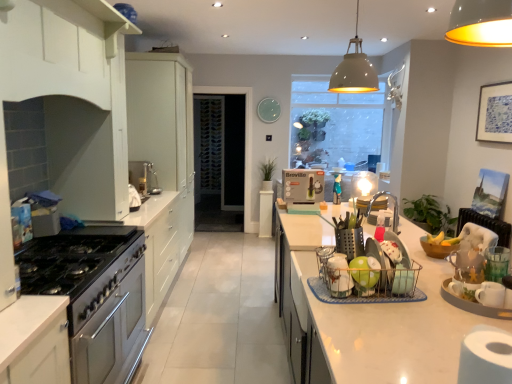
You are a GUI agent. You are given a task and a screenshot of the screen. Output one action in this format:
    pyautogui.click(x=<x>, y=<y>)
    Task: Click on the green matte plant at center, which is the 1th plant from top to bottom
    Image resolution: width=512 pixels, height=384 pixels.
    Given the screenshot: What is the action you would take?
    pyautogui.click(x=267, y=169)

Measure the distance between white wood shelf at upper center, which ranks as the first cabinetry in front-to-back order, and camera.

A distance of 1.42 meters exists between white wood shelf at upper center, which ranks as the first cabinetry in front-to-back order, and camera.

What do you see at coordinates (371, 294) in the screenshot? I see `metallic wire basket at right` at bounding box center [371, 294].

This screenshot has height=384, width=512. Identify the location of metallic wire basket at right. (371, 294).

The image size is (512, 384). What do you see at coordinates (221, 164) in the screenshot?
I see `transparent glass door at center` at bounding box center [221, 164].

The image size is (512, 384). What are the coordinates of `green matte dish rack at center, the fourth appliance when ordered from right to left` in the screenshot? It's located at (339, 276).

I want to click on green matte plant at center, arranged as the 2th plant when ordered from the bottom, so click(267, 169).

Is white matte pendant light at upper center positioned before white matte cabinet at left, arranged as the second cabinetry when viewed from the front?

No.

Which cabinetry is the 3rd one when counting from the left side of the white matte pendant light at upper center? Please provide its 2D coordinates.

[(72, 97)]

Between white matte pendant light at upper center and white matte cabinet at left, arranged as the second cabinetry when viewed from the front, which one has less height?

white matte pendant light at upper center is shorter.

Considering the sizes of objects white matte pendant light at upper center and white matte cabinet at left, which is the 2th cabinetry in back-to-front order, in the image provided, who is thinner, white matte pendant light at upper center or white matte cabinet at left, which is the 2th cabinetry in back-to-front order,?

white matte pendant light at upper center.

Does green leafy plant at right, which appears as the 1th plant when viewed from the right, have a smaller size compared to metallic wire basket at right?

Actually, green leafy plant at right, which appears as the 1th plant when viewed from the right, might be larger than metallic wire basket at right.

From a real-world perspective, is green leafy plant at right, which is counted as the first plant, starting from the front, over metallic wire basket at right?

No, from a real-world perspective, green leafy plant at right, which is counted as the first plant, starting from the front, is not above metallic wire basket at right.

In the image, is green leafy plant at right, which is counted as the first plant, starting from the front, positioned in front of or behind metallic wire basket at right?

green leafy plant at right, which is counted as the first plant, starting from the front, is positioned farther from the viewer than metallic wire basket at right.

Is white wood shelf at upper center, which ranks as the first cabinetry in front-to-back order, touching transparent glass door at center?

white wood shelf at upper center, which ranks as the first cabinetry in front-to-back order, and transparent glass door at center are not in contact.

Is white wood shelf at upper center, which ranks as the first cabinetry in front-to-back order, bigger than transparent glass door at center?

No.

Could you tell me if white wood shelf at upper center, which appears as the 3th cabinetry when viewed from the back, is facing transparent glass door at center?

No, white wood shelf at upper center, which appears as the 3th cabinetry when viewed from the back, is not facing towards transparent glass door at center.

Considering the sizes of white wood shelf at upper center, which ranks as the first cabinetry in front-to-back order, and transparent glass door at center in the image, is white wood shelf at upper center, which ranks as the first cabinetry in front-to-back order, wider or thinner than transparent glass door at center?

In the image, white wood shelf at upper center, which ranks as the first cabinetry in front-to-back order, appears to be more narrow than transparent glass door at center.

Considering the sizes of green leafy plant at right, positioned as the 2th plant in back-to-front order, and stainless steel oven at left in the image, is green leafy plant at right, positioned as the 2th plant in back-to-front order, wider or thinner than stainless steel oven at left?

green leafy plant at right, positioned as the 2th plant in back-to-front order, is thinner than stainless steel oven at left.

Would you say green leafy plant at right, which is the first plant from bottom to top, is outside stainless steel oven at left?

Indeed, green leafy plant at right, which is the first plant from bottom to top, is completely outside stainless steel oven at left.

From a real-world perspective, does green leafy plant at right, positioned as the 2th plant in back-to-front order, stand above stainless steel oven at left?

Yes, from a real-world perspective, green leafy plant at right, positioned as the 2th plant in back-to-front order, is over stainless steel oven at left

Which is in front, metallic silver utensil holder at right, the 3th appliance positioned from the left, or metallic wire basket at right?

metallic wire basket at right is closer to the camera.

Can we say metallic silver utensil holder at right, the third appliance viewed from the back, lies outside metallic wire basket at right?

Yes.

From the image's perspective, between metallic silver utensil holder at right, which appears as the second appliance when viewed from the right, and metallic wire basket at right, who is located below?

metallic wire basket at right.

Does metallic silver utensil holder at right, the third appliance viewed from the back, turn towards metallic wire basket at right?

No, metallic silver utensil holder at right, the third appliance viewed from the back, is not facing towards metallic wire basket at right.

Considering the sizes of white matte pendant light at upper center and metallic wire basket at right in the image, is white matte pendant light at upper center wider or thinner than metallic wire basket at right?

In the image, white matte pendant light at upper center appears to be more narrow than metallic wire basket at right.

Consider the image. Between white matte pendant light at upper center and metallic wire basket at right, which one has less height?

Standing shorter between the two is metallic wire basket at right.

Between white matte pendant light at upper center and metallic wire basket at right, which one appears on the left side from the viewer's perspective?

metallic wire basket at right is more to the left.

From the image's perspective, relative to matte white light bulb at center, marked as the 1th appliance in a right-to-left arrangement, is metallic wire basket at right above or below?

Clearly, from the image's perspective, metallic wire basket at right is below matte white light bulb at center, marked as the 1th appliance in a right-to-left arrangement.

Which is in front, point (352, 294) or point (366, 185)?

The point (352, 294) is closer to the camera.

From a real-world perspective, is metallic wire basket at right above or below matte white light bulb at center, the fourth appliance viewed from the left?

From a real-world perspective, metallic wire basket at right is physically below matte white light bulb at center, the fourth appliance viewed from the left.

Is metallic wire basket at right next to matte white light bulb at center, which is counted as the first appliance, starting from the back?

No, metallic wire basket at right is not making contact with matte white light bulb at center, which is counted as the first appliance, starting from the back.

Identify the location of light fixture that is above the white matte cabinet at left, which is the 2th cabinetry in back-to-front order (from a real-world perspective). (354, 70).

Locate an element on the screen. The height and width of the screenshot is (384, 512). plant on the right of metallic wire basket at right is located at coordinates (430, 214).

Based on their spatial positions, is green matte plant at center, the 1th plant positioned from the left, or green plastic kettle at center, the 2th appliance when ordered from back to front, closer to metallic silver utensil holder at right, the second appliance from the front?

green plastic kettle at center, the 2th appliance when ordered from back to front.

Looking at the image, which one is located closer to translucent glass window at center, white glossy countertop at right or green matte plant at center, arranged as the 2th plant when ordered from the bottom?

green matte plant at center, arranged as the 2th plant when ordered from the bottom.

Which object lies nearer to the anchor point matte white light bulb at center, marked as the 1th appliance in a right-to-left arrangement, metallic silver utensil holder at right, the third appliance viewed from the back, or green plastic kettle at center, the 3th appliance positioned from the front?

green plastic kettle at center, the 3th appliance positioned from the front, is positioned closer to the anchor matte white light bulb at center, marked as the 1th appliance in a right-to-left arrangement.

Looking at the image, which one is located closer to transparent glass door at center, white glossy countertop at right or white matte pendant light at upper center?

Based on the image, white matte pendant light at upper center appears to be nearer to transparent glass door at center.

Estimate the real-world distances between objects in this image. Which object is further from white wood shelf at upper center, which ranks as the first cabinetry in front-to-back order, green matte plant at center, which appears as the 1th plant when viewed from the back, or green plastic kettle at center, which is the 2th appliance from left to right?

green matte plant at center, which appears as the 1th plant when viewed from the back, lies further to white wood shelf at upper center, which ranks as the first cabinetry in front-to-back order, than the other object.

Based on the photo, estimate the real-world distances between objects in this image. Which object is closer to transparent glass door at center, white glossy countertop at right or stainless steel oven at left?

Answer: white glossy countertop at right is closer to transparent glass door at center.

Considering their positions, is blue paper picture frame at upper right positioned further to white glossy countertop at right than green matte plant at center, arranged as the second plant when viewed from the right?

green matte plant at center, arranged as the second plant when viewed from the right, is further to white glossy countertop at right.

Looking at the image, which one is located closer to white matte cabinet at left, arranged as the second cabinetry when viewed from the front, metallic wire basket at right or green matte dish rack at center, the fourth appliance when ordered from right to left?

Among the two, metallic wire basket at right is located nearer to white matte cabinet at left, arranged as the second cabinetry when viewed from the front.

You are a GUI agent. You are given a task and a screenshot of the screen. Output one action in this format:
    pyautogui.click(x=<x>, y=<y>)
    Task: Click on the cabinetry between white matte pendant light at upper center and transparent glass door at center along the z-axis
    
    Given the screenshot: What is the action you would take?
    pyautogui.click(x=162, y=162)

Where is `light fixture between metallic wire basket at right and transparent glass door at center along the z-axis`? light fixture between metallic wire basket at right and transparent glass door at center along the z-axis is located at coordinates (354, 70).

What are the coordinates of `glass door located between white matte cabinet at left, arranged as the second cabinetry when viewed from the front, and translucent glass window at center in the depth direction` in the screenshot? It's located at (221, 164).

The image size is (512, 384). Find the location of `light fixture located between green matte dish rack at center, the fourth appliance when ordered from right to left, and translucent glass window at center in the depth direction`. light fixture located between green matte dish rack at center, the fourth appliance when ordered from right to left, and translucent glass window at center in the depth direction is located at coordinates (354, 70).